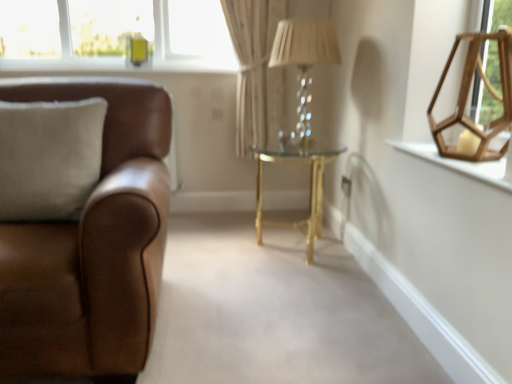
Question: Is brown leather couch at left situated inside beige fabric curtain at center or outside?

Choices:
 (A) inside
 (B) outside

Answer: (B)

Question: Looking at the image, does brown leather couch at left seem bigger or smaller compared to beige fabric curtain at center?

Choices:
 (A) small
 (B) big

Answer: (B)

Question: Considering the real-world distances, which object is closest to the brown leather couch at left?

Choices:
 (A) suede beige pillow at left
 (B) translucent glass table lamp at center
 (C) wooden hexagonal frame at upper right
 (D) beige fabric curtain at center
 (E) gold metallic side table at center

Answer: (A)

Question: Which object is the closest to the suede beige pillow at left?

Choices:
 (A) gold metallic side table at center
 (B) beige fabric curtain at center
 (C) brown leather couch at left
 (D) translucent glass table lamp at center
 (E) wooden hexagonal frame at upper right

Answer: (C)